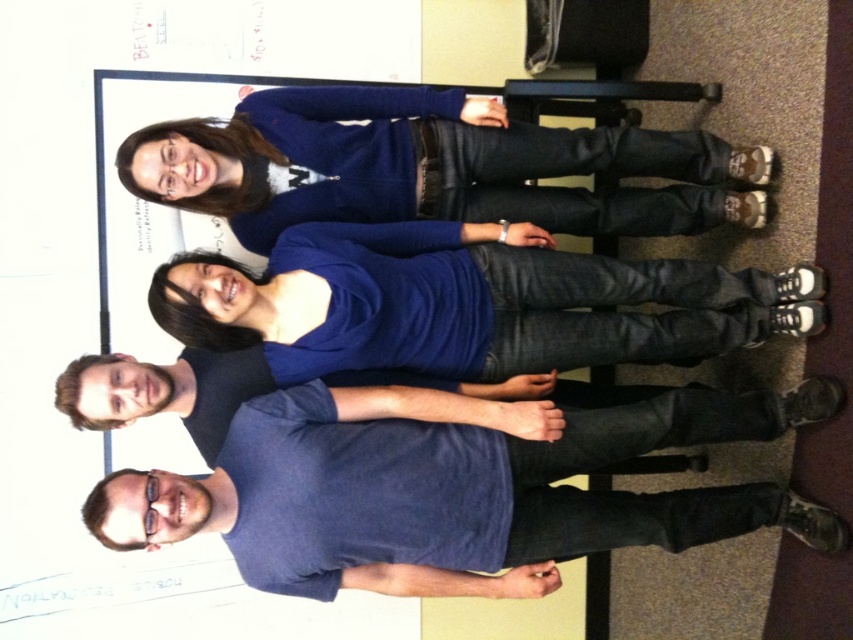
You are a photographer trying to capture a group photo. You notice the blue denim jeans at center and the blue sweater at upper center in the frame. Which of these two items would appear closer to the camera based on their sizes?

The blue denim jeans at center appears smaller than the blue sweater at upper center. Since objects closer to the camera appear larger, the blue sweater at upper center is closer to the camera.

You are standing in the classroom and want to take a photo of the two points mentioned. Which point is closer to the camera, point (x=236, y=444) or point (x=350, y=323)?

Point (x=236, y=444) is further to the camera than point (x=350, y=323), so the closer point to the camera is point (x=350, y=323).